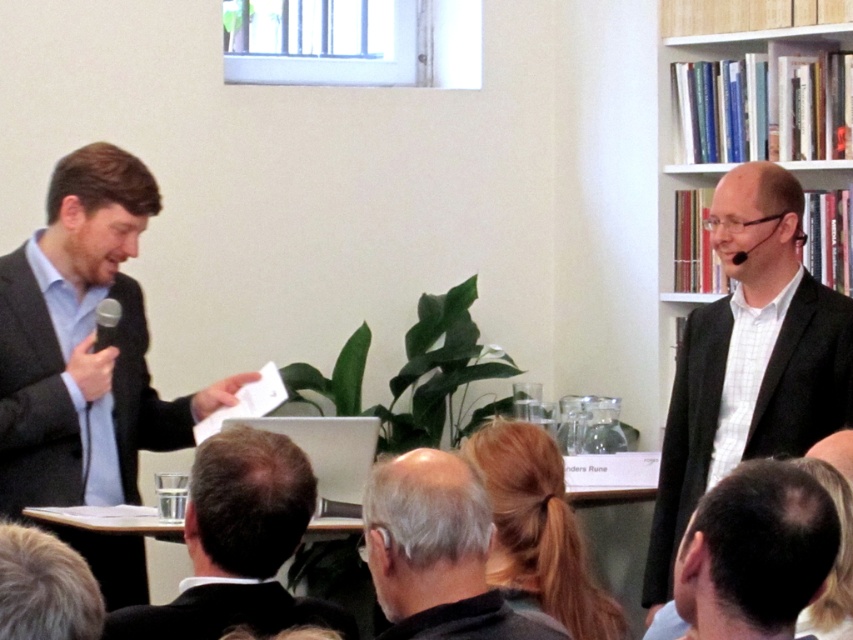
Can you confirm if matte black suit at left is thinner than blonde hair at center?

Incorrect, matte black suit at left's width is not less than blonde hair at center's.

How distant is matte black suit at left from blonde hair at center?

1.50 meters

The height and width of the screenshot is (640, 853). Describe the element at coordinates (84, 346) in the screenshot. I see `matte black suit at left` at that location.

I want to click on matte black suit at left, so click(84, 346).

Can you confirm if black matte suit at lower center is positioned below black matte microphone at upper right?

Correct, black matte suit at lower center is located below black matte microphone at upper right.

The image size is (853, 640). Describe the element at coordinates (225, 611) in the screenshot. I see `black matte suit at lower center` at that location.

The width and height of the screenshot is (853, 640). I want to click on black matte suit at lower center, so click(x=225, y=611).

Who is more forward, (538, 465) or (1, 531)?

Positioned in front is point (1, 531).

Does blonde hair at center lie in front of dark brown hair at lower left?

No, blonde hair at center is behind dark brown hair at lower left.

This screenshot has height=640, width=853. I want to click on blonde hair at center, so click(x=537, y=531).